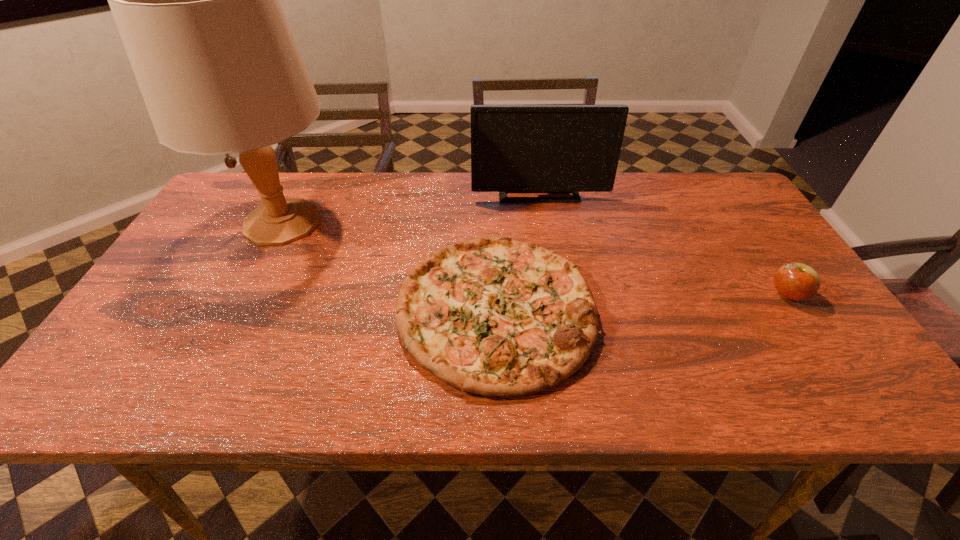
This screenshot has height=540, width=960. What are the coordinates of `the tallest object` in the screenshot? It's located at (196, 1).

At what (x,y) coordinates should I click in order to perform the action: click on table lamp. Please return your answer as a coordinate pair (x, y). This screenshot has height=540, width=960. Looking at the image, I should click on (196, 1).

What are the coordinates of `computer monitor` in the screenshot? It's located at (514, 148).

Where is `apple`? The width and height of the screenshot is (960, 540). apple is located at coordinates (797, 281).

This screenshot has width=960, height=540. Identify the location of pizza. (493, 316).

I want to click on vacant space situated on the front of the tallest object, so click(207, 370).

You are a GUI agent. You are given a task and a screenshot of the screen. Output one action in this format:
    pyautogui.click(x=<x>, y=<y>)
    Task: Click on the vacant area situated on the screen side of the computer monitor
    The height and width of the screenshot is (540, 960).
    Given the screenshot: What is the action you would take?
    pyautogui.click(x=556, y=295)

Where is `free space located 0.080m on the front of the rightmost object`? This screenshot has height=540, width=960. free space located 0.080m on the front of the rightmost object is located at coordinates (816, 336).

This screenshot has width=960, height=540. I want to click on vacant space located 0.250m on the back of the shortest object, so click(x=492, y=191).

This screenshot has width=960, height=540. Find the location of `table lamp at the far edge`. table lamp at the far edge is located at coordinates (196, 1).